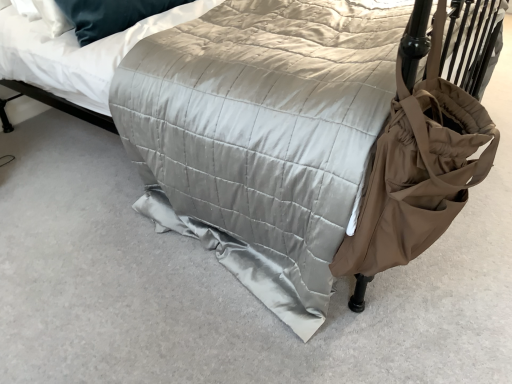
Question: Would you say silky white mattress at upper center is to the left or to the right of brown fabric bag at right in the picture?

Choices:
 (A) left
 (B) right

Answer: (A)

Question: Considering the positions of point (101, 110) and point (463, 195), is point (101, 110) closer or farther from the camera than point (463, 195)?

Choices:
 (A) farther
 (B) closer

Answer: (A)

Question: Is silky white mattress at upper center wider or thinner than brown fabric bag at right?

Choices:
 (A) thin
 (B) wide

Answer: (B)

Question: From a real-world perspective, is brown fabric bag at right positioned above or below silky white mattress at upper center?

Choices:
 (A) above
 (B) below

Answer: (B)

Question: Looking at their shapes, would you say brown fabric bag at right is wider or thinner than silky white mattress at upper center?

Choices:
 (A) wide
 (B) thin

Answer: (B)

Question: Is brown fabric bag at right bigger or smaller than silky white mattress at upper center?

Choices:
 (A) big
 (B) small

Answer: (B)

Question: Is point (451, 178) positioned closer to the camera than point (62, 84)?

Choices:
 (A) closer
 (B) farther

Answer: (A)